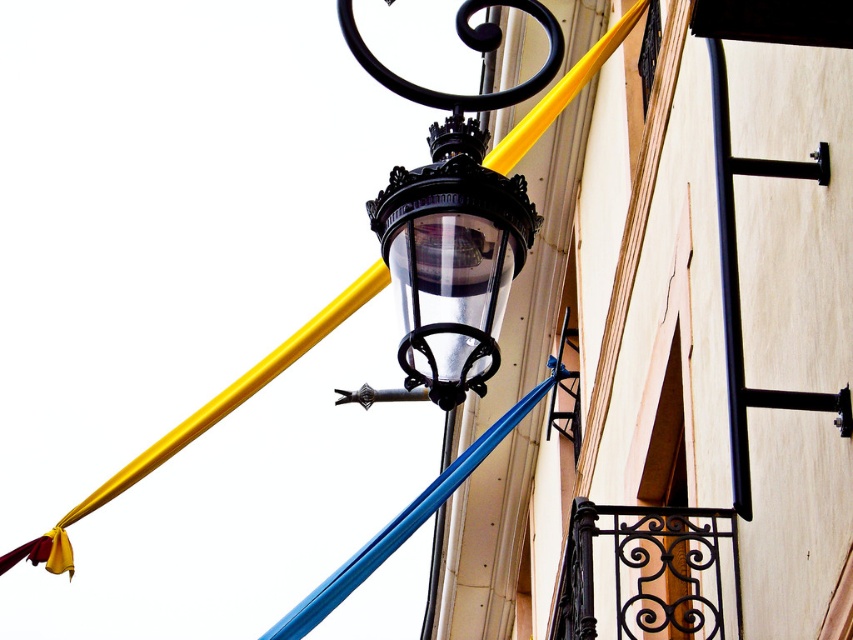
You are a window cleaner standing on a ladder. You need to clean both the black glass lantern at center and the black metal pole at upper center. Which object will require you to climb higher on the ladder?

The black metal pole at upper center is taller than the black glass lantern at center, so you will need to climb higher to reach the black metal pole at upper center.

You are standing in front of the street lamp described in the scene. A point with coordinates (450, 262) is mentioned. Which object does this point correspond to?

Result: The point corresponds to the black glass lantern at center.